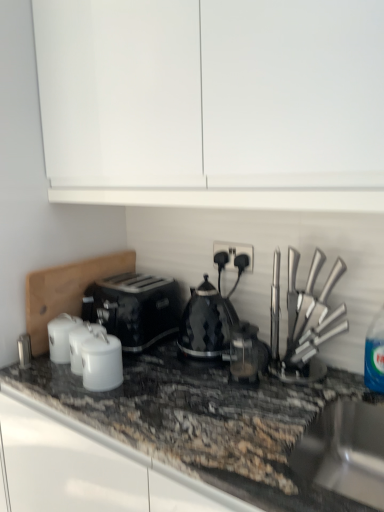
Question: Is blue plastic bottle at right taller or shorter than black diamond-patterned kettle at center, placed as the third kitchen appliance when sorted from left to right?

Choices:
 (A) tall
 (B) short

Answer: (B)

Question: In the image, is blue plastic bottle at right on the left side or the right side of black diamond-patterned kettle at center, placed as the third kitchen appliance when sorted from left to right?

Choices:
 (A) left
 (B) right

Answer: (B)

Question: Based on their relative distances, which object is nearer to the black matte toaster at center?

Choices:
 (A) polished stainless steel knife set at right, the first kitchen appliance when ordered from right to left
 (B) white glossy canister at center, which is the second kitchen appliance from left to right
 (C) stainless steel sink at lower right
 (D) black plastic socket at center
 (E) black diamond-patterned kettle at center, placed as the third kitchen appliance when sorted from left to right

Answer: (E)

Question: Which is farther from the blue plastic bottle at right?

Choices:
 (A) black plastic socket at center
 (B) satin black coffee machine at center
 (C) polished stainless steel knife set at right, the first kitchen appliance when ordered from right to left
 (D) black matte toaster at center
 (E) black diamond-patterned kettle at center, placed as the 2th kitchen appliance when sorted from right to left

Answer: (D)